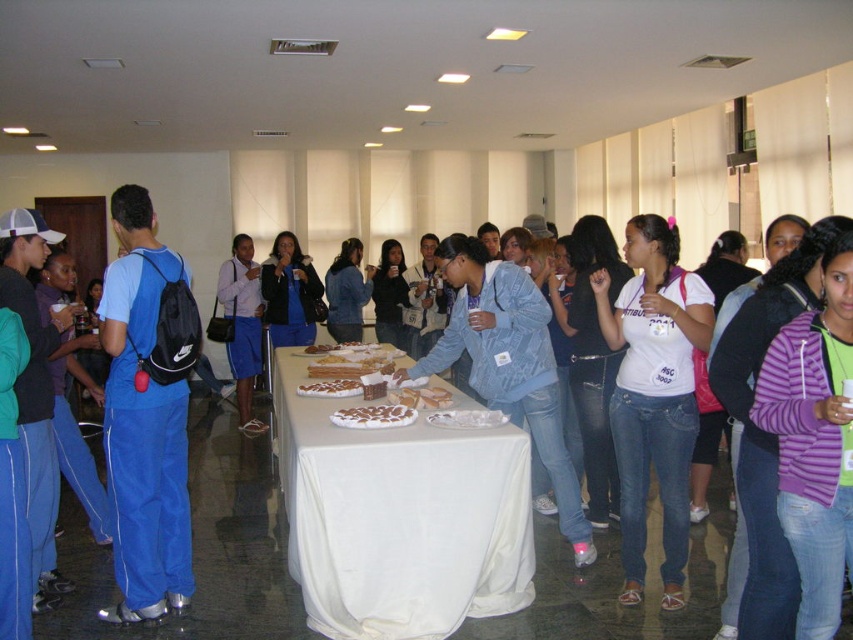
You are standing at the entrance of the hall and see the point marked at coordinates (399,516). What object is located at that point?

The white cloth table at center is located at point (399,516).